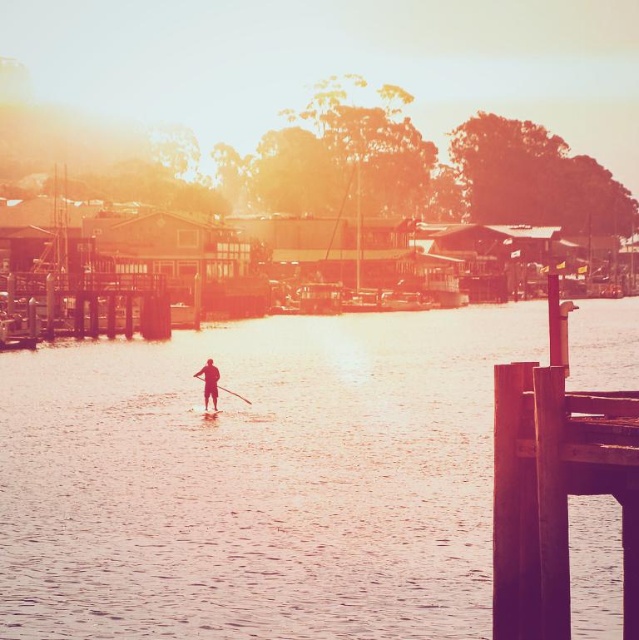
You are planning to take a photo of the wooden dock at right and the smooth skin paddleboarder at center from the shore. Which object would appear bigger in your photo?

The wooden dock at right would appear bigger in the photo because it has a larger size compared to the smooth skin paddleboarder at center.

You are standing on the wooden dock at right and want to reach the paddleboarder who is 12.80 meters away from you. Can you walk directly to them along the dock?

The wooden dock at right is 12.80 meters from the camera, but the distance to the paddleboarder isn